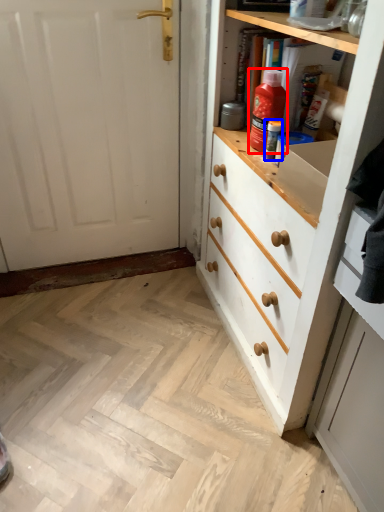
Question: Which object is further to the camera taking this photo, cleaning product (highlighted by a red box) or bottle (highlighted by a blue box)?

Choices:
 (A) cleaning product
 (B) bottle

Answer: (B)